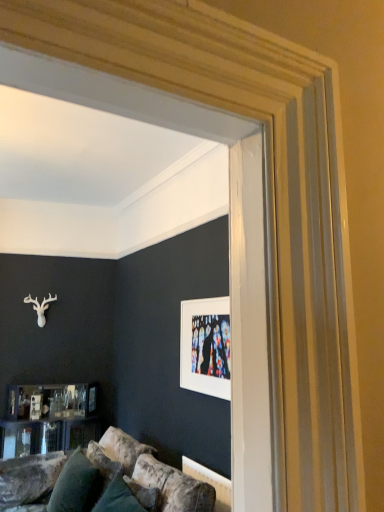
Find the location of a particular element. The width and height of the screenshot is (384, 512). white matte picture frame at upper center is located at coordinates (206, 346).

The width and height of the screenshot is (384, 512). What do you see at coordinates (206, 346) in the screenshot?
I see `white matte picture frame at upper center` at bounding box center [206, 346].

The width and height of the screenshot is (384, 512). Describe the element at coordinates (76, 485) in the screenshot. I see `velvety green pillow at lower left` at that location.

What is the approximate width of velvety green pillow at lower left?

The width of velvety green pillow at lower left is 12.27 inches.

You are a GUI agent. You are given a task and a screenshot of the screen. Output one action in this format:
    pyautogui.click(x=<x>, y=<y>)
    Task: Click on the velvety green pillow at lower left
    
    Given the screenshot: What is the action you would take?
    pyautogui.click(x=76, y=485)

The width and height of the screenshot is (384, 512). In order to click on white matte picture frame at upper center in this screenshot , I will do `click(206, 346)`.

Is white matte picture frame at upper center to the left of velvety green pillow at lower left from the viewer's perspective?

Incorrect, white matte picture frame at upper center is not on the left side of velvety green pillow at lower left.

Which object is further away from the camera taking this photo, white matte picture frame at upper center or velvety green pillow at lower left?

velvety green pillow at lower left.

Is point (225, 380) farther from viewer compared to point (81, 475)?

No, (225, 380) is in front of (81, 475).

From the image's perspective, which is above, white matte picture frame at upper center or velvety green pillow at lower left?

white matte picture frame at upper center, from the image's perspective.

From a real-world perspective, is white matte picture frame at upper center over velvety green pillow at lower left?

Yes.

Which object is thinner, white matte picture frame at upper center or velvety green pillow at lower left?

white matte picture frame at upper center.

Who is shorter, white matte picture frame at upper center or velvety green pillow at lower left?

Standing shorter between the two is velvety green pillow at lower left.

Based on the photo, considering the sizes of objects white matte picture frame at upper center and velvety green pillow at lower left in the image provided, who is bigger, white matte picture frame at upper center or velvety green pillow at lower left?

Bigger between the two is velvety green pillow at lower left.

Would you say white matte picture frame at upper center is inside or outside velvety green pillow at lower left?

white matte picture frame at upper center is spatially situated outside velvety green pillow at lower left.

Is white matte picture frame at upper center touching velvety green pillow at lower left?

No, white matte picture frame at upper center is not beside velvety green pillow at lower left.

Is white matte picture frame at upper center aimed at velvety green pillow at lower left?

No, white matte picture frame at upper center does not turn towards velvety green pillow at lower left.

Find the location of `picture frame above the velvety green pillow at lower left (from a real-world perspective)`. picture frame above the velvety green pillow at lower left (from a real-world perspective) is located at coordinates (206, 346).

Which is more to the left, velvety green pillow at lower left or white matte picture frame at upper center?

velvety green pillow at lower left.

Is the depth of velvety green pillow at lower left greater than that of white matte picture frame at upper center?

Yes, velvety green pillow at lower left is further from the viewer.

Which is farther, (55, 495) or (195, 325)?

The point (195, 325) is behind.

From the image's perspective, is velvety green pillow at lower left located above white matte picture frame at upper center?

No, from the image's perspective, velvety green pillow at lower left is not on top of white matte picture frame at upper center.

From a real-world perspective, is velvety green pillow at lower left positioned above or below white matte picture frame at upper center?

In terms of real-world spatial position, velvety green pillow at lower left is below white matte picture frame at upper center.

Which of these two, velvety green pillow at lower left or white matte picture frame at upper center, is thinner?

With smaller width is white matte picture frame at upper center.

Considering the relative sizes of velvety green pillow at lower left and white matte picture frame at upper center in the image provided, is velvety green pillow at lower left shorter than white matte picture frame at upper center?

Yes, velvety green pillow at lower left is shorter than white matte picture frame at upper center.

Who is bigger, velvety green pillow at lower left or white matte picture frame at upper center?

velvety green pillow at lower left.

Could white matte picture frame at upper center be considered to be inside velvety green pillow at lower left?

Actually, white matte picture frame at upper center is outside velvety green pillow at lower left.

From the picture: Is there a large distance between velvety green pillow at lower left and white matte picture frame at upper center?

Yes.

Could you tell me if velvety green pillow at lower left is turned towards white matte picture frame at upper center?

No, velvety green pillow at lower left is not turned towards white matte picture frame at upper center.

Can you tell me how much velvety green pillow at lower left and white matte picture frame at upper center differ in facing direction?

velvety green pillow at lower left and white matte picture frame at upper center are facing 2.87 degrees away from each other.

Could you measure the distance between velvety green pillow at lower left and white matte picture frame at upper center?

velvety green pillow at lower left is 3.39 feet from white matte picture frame at upper center.

Locate an element on the screen. Image resolution: width=384 pixels, height=512 pixels. picture frame located above the velvety green pillow at lower left (from a real-world perspective) is located at coordinates (206, 346).

You are a GUI agent. You are given a task and a screenshot of the screen. Output one action in this format:
    pyautogui.click(x=<x>, y=<y>)
    Task: Click on the pillow below the white matte picture frame at upper center (from the image's perspective)
    Image resolution: width=384 pixels, height=512 pixels.
    Given the screenshot: What is the action you would take?
    pyautogui.click(x=76, y=485)

You are a GUI agent. You are given a task and a screenshot of the screen. Output one action in this format:
    pyautogui.click(x=<x>, y=<y>)
    Task: Click on the picture frame that appears above the velvety green pillow at lower left (from the image's perspective)
    The width and height of the screenshot is (384, 512).
    Given the screenshot: What is the action you would take?
    pyautogui.click(x=206, y=346)